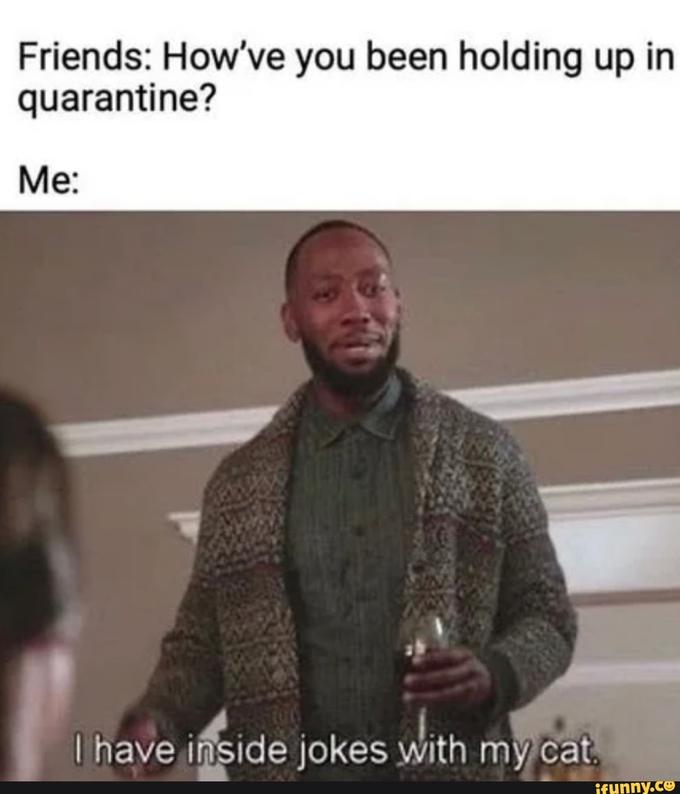
You are a GUI agent. You are given a task and a screenshot of the screen. Output one action in this format:
    pyautogui.click(x=<x>, y=<y>)
    Task: Click on the glass stem of wine glass
    
    Given the screenshot: What is the action you would take?
    pyautogui.click(x=420, y=733)